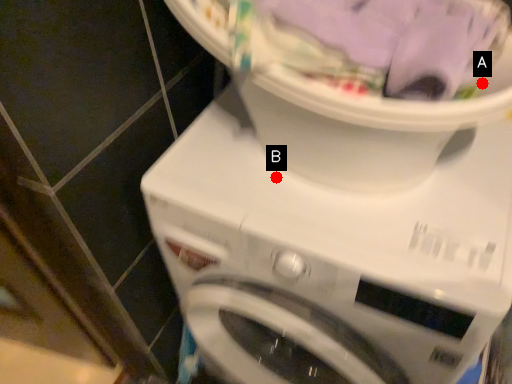
Question: Two points are circled on the image, labeled by A and B beside each circle. Which point is closer to the camera?

Choices:
 (A) A is closer
 (B) B is closer

Answer: (A)